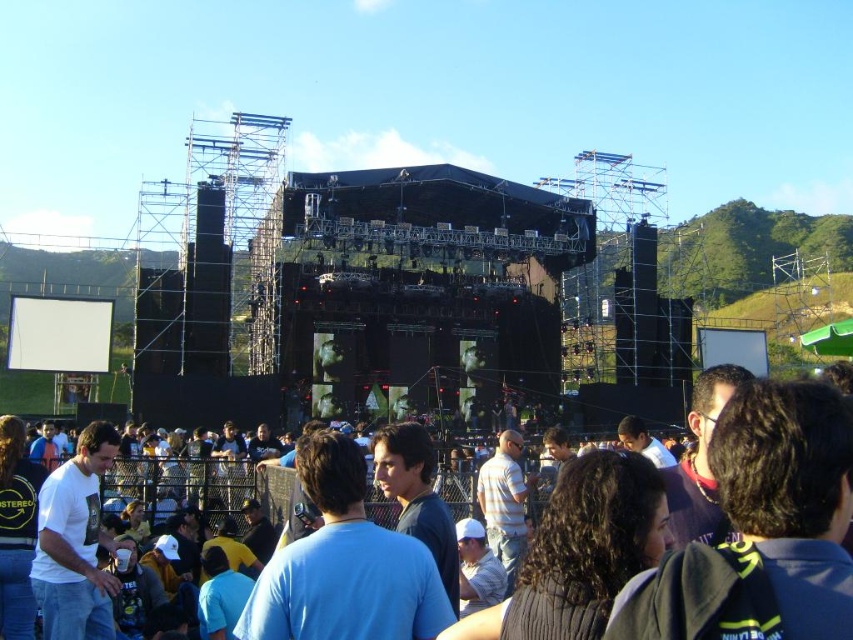
From the picture: You are a photographer at the concert and want to capture both the blue cotton shirt at center and the white cotton shirt at lower left in the same frame. Which shirt should you adjust your camera angle to focus on first to ensure both are visible?

The blue cotton shirt at center is much taller than the white cotton shirt at lower left, so you should focus on the blue cotton shirt at center first to ensure it fits in the frame, then adjust to include the shorter white cotton shirt at lower left.

You are at an outdoor concert and want to get a better view of the stage. You notice a blue cotton shirt at center and a white cotton shirt at lower left in front of you. Which shirt should you move around to see the stage better?

The blue cotton shirt at center is closer to the viewer than the white cotton shirt at lower left. To get a better view, you should move around the blue cotton shirt at center since it is closer and blocking your view.